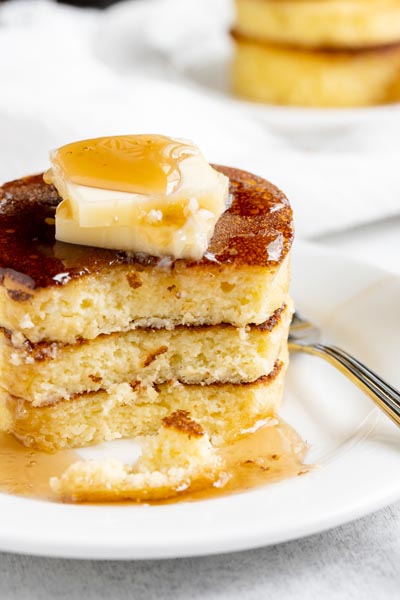
The height and width of the screenshot is (600, 400). I want to click on bowl, so tap(153, 61).